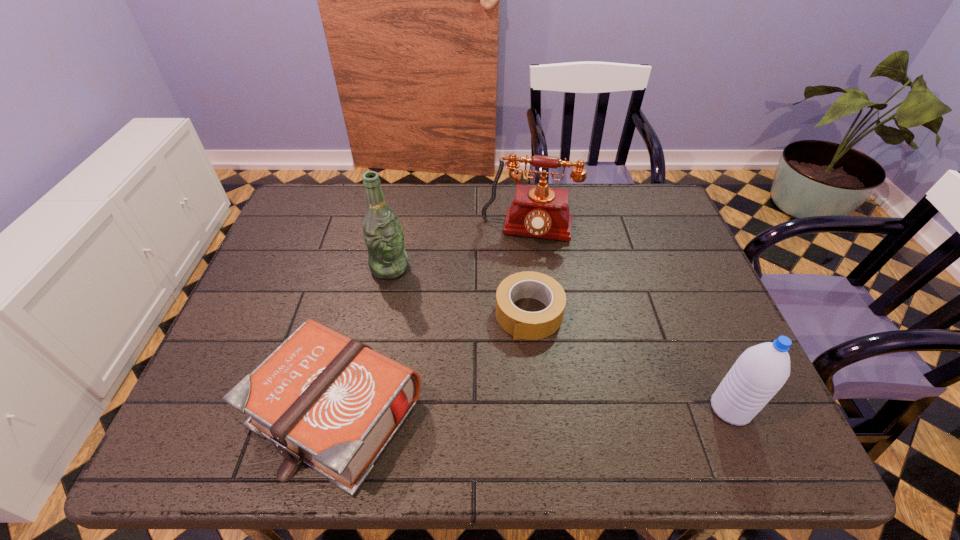
Find the location of a particular element. free space between the second shortest object and the fourth nearest object is located at coordinates point(363,340).

Locate an element on the screen. Image resolution: width=960 pixels, height=540 pixels. unoccupied area between the second shortest object and the water bottle is located at coordinates (533, 410).

You are a GUI agent. You are given a task and a screenshot of the screen. Output one action in this format:
    pyautogui.click(x=<x>, y=<y>)
    Task: Click on the vacant space that's between the rightmost object and the fourth tallest object
    The height and width of the screenshot is (540, 960).
    Given the screenshot: What is the action you would take?
    pyautogui.click(x=533, y=410)

The image size is (960, 540). Identify the location of vacant space that's between the duct tape and the rightmost object. (630, 361).

Where is `vacant area between the tallest object and the water bottle`? Image resolution: width=960 pixels, height=540 pixels. vacant area between the tallest object and the water bottle is located at coordinates (560, 338).

At what (x,y) coordinates should I click in order to perform the action: click on blank region between the shortest object and the water bottle. Please return your answer as a coordinate pair (x, y). Looking at the image, I should click on (630, 361).

You are a GUI agent. You are given a task and a screenshot of the screen. Output one action in this format:
    pyautogui.click(x=<x>, y=<y>)
    Task: Click on the free space between the telephone and the water bottle
    This screenshot has width=960, height=540.
    Given the screenshot: What is the action you would take?
    pyautogui.click(x=630, y=320)

Find the location of `free point between the farthest object and the rightmost object`. free point between the farthest object and the rightmost object is located at coordinates point(630,320).

Locate an element on the screen. empty space between the Bible and the farthest object is located at coordinates (432, 321).

Identify the location of free space that is in between the water bottle and the shortest object. This screenshot has height=540, width=960. (630, 361).